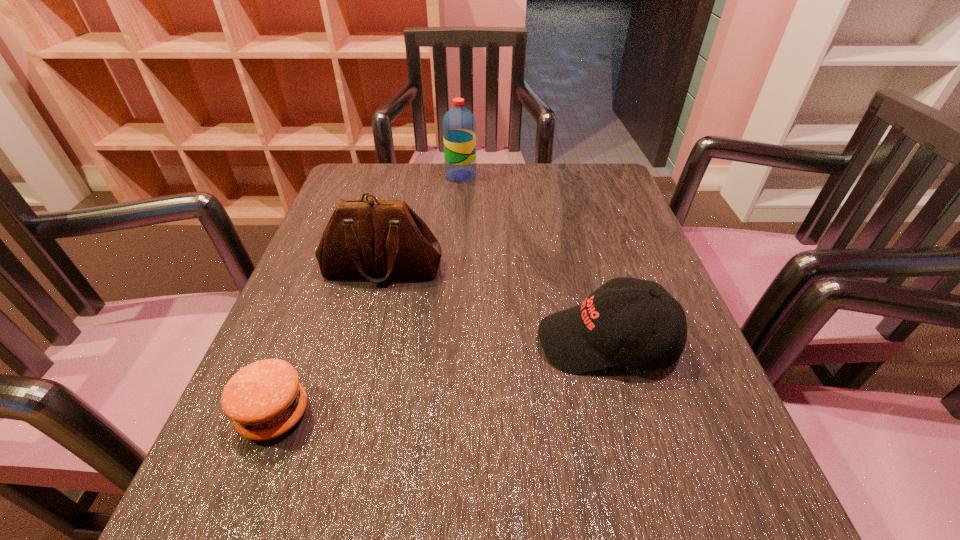
You are a GUI agent. You are given a task and a screenshot of the screen. Output one action in this format:
    pyautogui.click(x=<x>, y=<y>)
    Task: Click on the farthest object
    The width and height of the screenshot is (960, 540).
    Given the screenshot: What is the action you would take?
    pyautogui.click(x=459, y=126)

Image resolution: width=960 pixels, height=540 pixels. In order to click on shoulder bag in this screenshot , I will do `click(375, 239)`.

Locate an element on the screen. This screenshot has height=540, width=960. the second tallest object is located at coordinates (375, 239).

You are a GUI agent. You are given a task and a screenshot of the screen. Output one action in this format:
    pyautogui.click(x=<x>, y=<y>)
    Task: Click on the third farthest object
    The width and height of the screenshot is (960, 540).
    Given the screenshot: What is the action you would take?
    pyautogui.click(x=591, y=336)

The image size is (960, 540). Identify the location of the second shortest object. (591, 336).

Find the location of a particular element. This screenshot has width=960, height=540. the nearest object is located at coordinates (264, 399).

Locate an element on the screen. Image resolution: width=960 pixels, height=540 pixels. patty is located at coordinates (264, 399).

In order to click on blank space located 0.190m on the front label of the water bottle in this screenshot , I will do `click(546, 176)`.

Where is `free space located 0.240m on the front of the shoulder bag`? free space located 0.240m on the front of the shoulder bag is located at coordinates (350, 395).

Find the location of `vacant area situated 0.160m on the front-facing side of the rightmost object`. vacant area situated 0.160m on the front-facing side of the rightmost object is located at coordinates (445, 342).